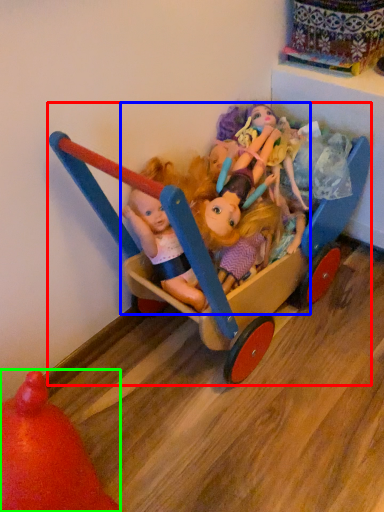
Question: Estimate the real-world distances between objects in this image. Which object is closer to toy (highlighted by a red box), doll (highlighted by a blue box) or toy (highlighted by a green box)?

Choices:
 (A) doll
 (B) toy

Answer: (A)